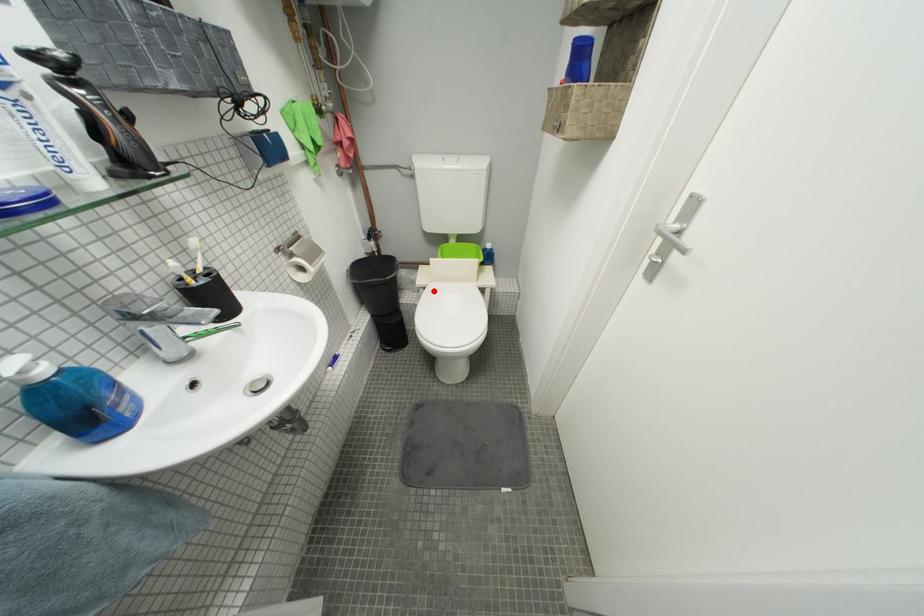
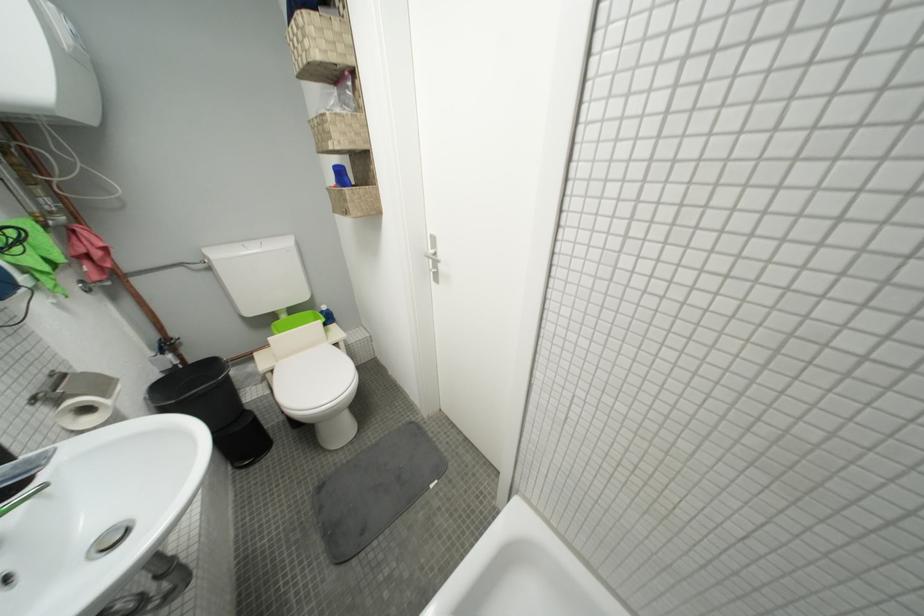
The point at the highlighted location is marked in the first image. Where is the corresponding point in the second image?

(281, 373)